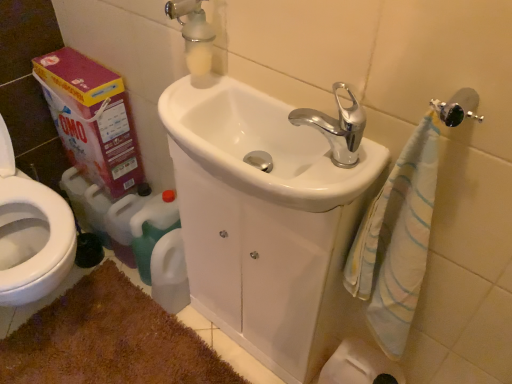
At what (x,y) coordinates should I click in order to perform the action: click on vacant space in front of chrome metallic faucet at upper center. Please return your answer as a coordinate pair (x, y). This screenshot has width=512, height=384. Looking at the image, I should click on pyautogui.click(x=323, y=185).